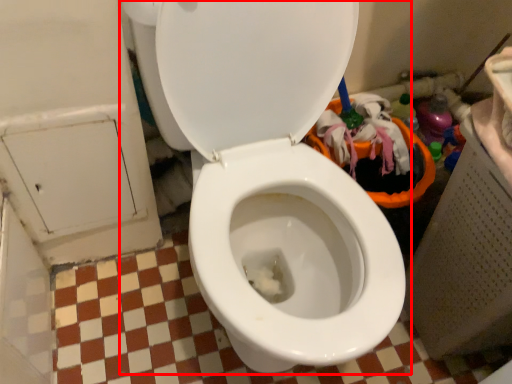
Question: From the image, what is the correct spatial relationship of toilet (annotated by the red box) in relation to dust?

Choices:
 (A) right
 (B) left

Answer: (B)